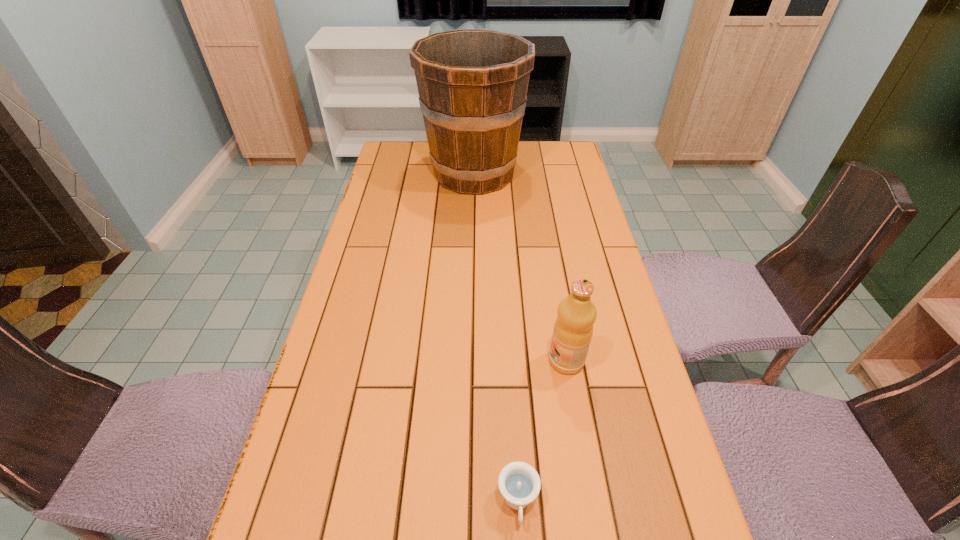
You are a GUI agent. You are given a task and a screenshot of the screen. Output one action in this format:
    pyautogui.click(x=<x>, y=<y>)
    Task: Click on the farthest object
    Image resolution: width=960 pixels, height=540 pixels.
    Given the screenshot: What is the action you would take?
    pyautogui.click(x=472, y=84)

This screenshot has height=540, width=960. What are the coordinates of `bucket` in the screenshot? It's located at (472, 84).

Locate an element on the screen. Image resolution: width=960 pixels, height=540 pixels. fruit juice is located at coordinates (573, 329).

Where is `the second farthest object`? The height and width of the screenshot is (540, 960). the second farthest object is located at coordinates (573, 329).

Locate an element on the screen. The image size is (960, 540). the nearest object is located at coordinates (519, 483).

Locate an element on the screen. the shortest object is located at coordinates (519, 483).

The image size is (960, 540). What are the coordinates of `vacant space located on the left of the tallest object` in the screenshot? It's located at (404, 174).

Find the location of a particular element. The height and width of the screenshot is (540, 960). vacant position located 0.390m on the front label of the second nearest object is located at coordinates (384, 361).

Where is `free point located on the front label of the second nearest object`? The height and width of the screenshot is (540, 960). free point located on the front label of the second nearest object is located at coordinates (498, 361).

At what (x,y) coordinates should I click in order to perform the action: click on vacant space positioned on the front label of the second nearest object. Please return your answer as a coordinate pair (x, y). This screenshot has height=540, width=960. Looking at the image, I should click on (419, 361).